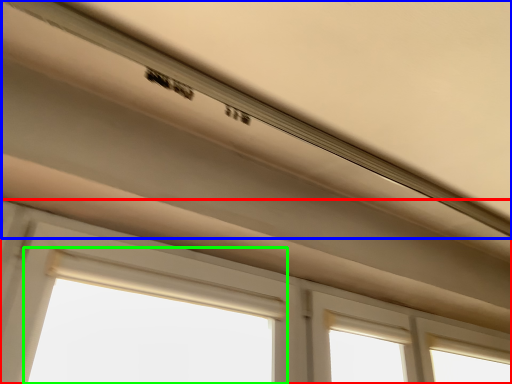
Question: Which object is positioned closest to window (highlighted by a red box)? Select from exhaust hood (highlighted by a blue box) and bay window (highlighted by a green box).

Choices:
 (A) exhaust hood
 (B) bay window

Answer: (B)